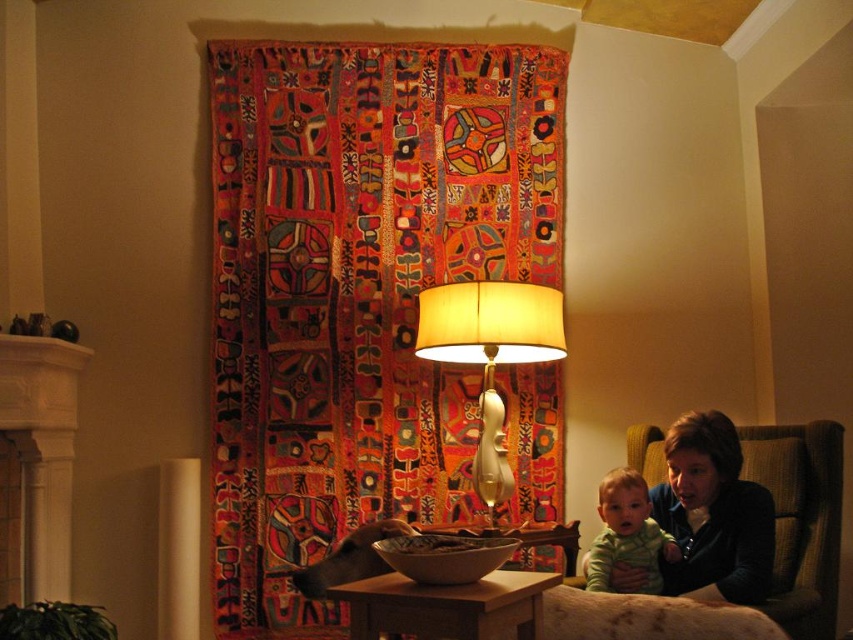
Is dark brown leather jacket at lower right to the left of smooth brown bowl at center from the viewer's perspective?

No, dark brown leather jacket at lower right is not to the left of smooth brown bowl at center.

Can you confirm if dark brown leather jacket at lower right is positioned to the right of smooth brown bowl at center?

Indeed, dark brown leather jacket at lower right is positioned on the right side of smooth brown bowl at center.

Does point (741, 518) come farther from viewer compared to point (405, 544)?

Yes, point (741, 518) is farther from viewer.

Where is `dark brown leather jacket at lower right`? The image size is (853, 640). dark brown leather jacket at lower right is located at coordinates (712, 515).

Does white stone fireplace at left have a smaller size compared to wooden table at center?

No, white stone fireplace at left is not smaller than wooden table at center.

Can you confirm if white stone fireplace at left is taller than wooden table at center?

Correct, white stone fireplace at left is much taller as wooden table at center.

The image size is (853, 640). What do you see at coordinates (36, 465) in the screenshot?
I see `white stone fireplace at left` at bounding box center [36, 465].

The width and height of the screenshot is (853, 640). I want to click on white stone fireplace at left, so click(x=36, y=465).

Who is taller, multicolored woven tapestry at upper center or white stone fireplace at left?

multicolored woven tapestry at upper center is taller.

Is multicolored woven tapestry at upper center to the right of white stone fireplace at left from the viewer's perspective?

Indeed, multicolored woven tapestry at upper center is positioned on the right side of white stone fireplace at left.

Measure the distance between point (453, 208) and camera.

A distance of 11.63 feet exists between point (453, 208) and camera.

Locate an element on the screen. multicolored woven tapestry at upper center is located at coordinates (357, 291).